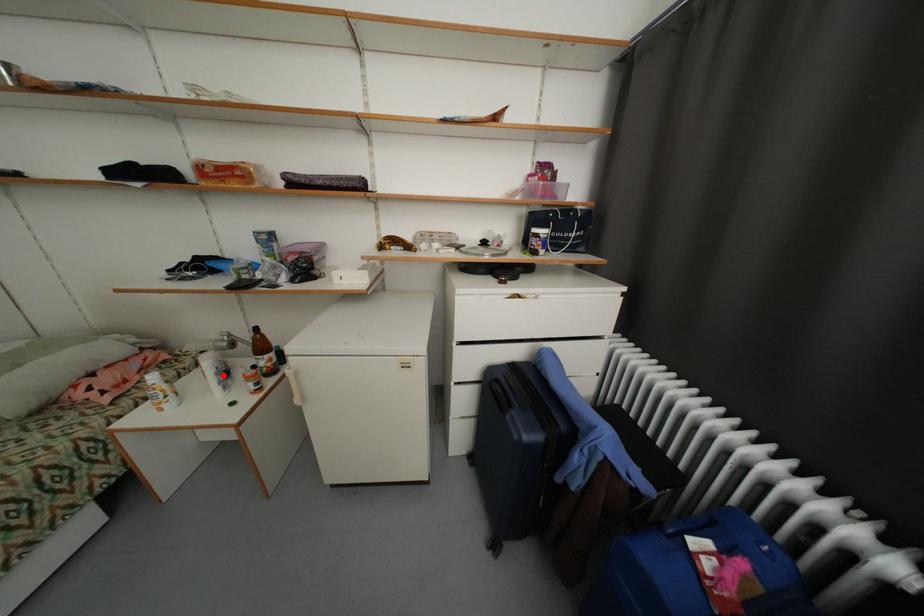
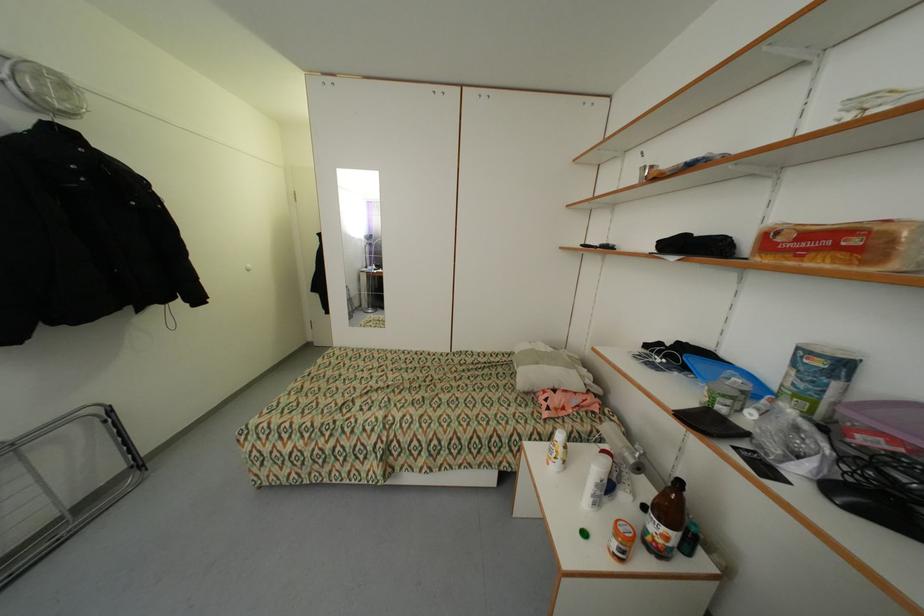
Question: I am providing you with two images of the same scene from different viewpoints. Given a red point in image1, look at the same physical point in image2. Is it:

Choices:
 (A) Closer to the viewpoint
 (B) Farther from the viewpoint

Answer: (B)